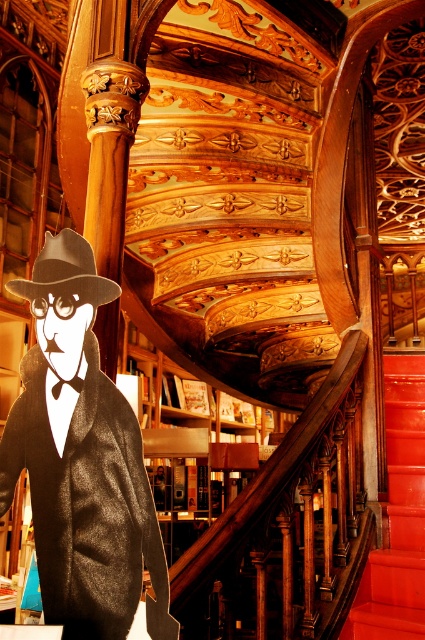
You are a tailor measuring two items for a client. The client has a matte black coat at center and a matte brown fedora at center. The tailor needs to know if the distance between them is sufficient to place a 12 inch ruler between them without moving the items. Can the tailor do this?

The matte black coat at center and matte brown fedora at center are 10.65 inches apart, which is less than 12 inches. Therefore, the tailor cannot place a 12 inch ruler between them without moving the items.

Looking at this image, you are an interior designer planning to hang a decorative item on the wall behind the matte black coat at center and the matte brown fedora at center. Since both items are at the center, which one should you consider positioning your new decoration relative to?

The matte black coat at center is in front of the matte brown fedora at center, so you should position the new decoration behind the matte brown fedora at center to ensure it is visible behind both items.

You are standing at the base of the grand staircase and notice two items at the center of the scene. One is the shiny red stair at center and the other is the matte brown fedora at center. Which item is positioned to the right when viewed from your perspective?

The shiny red stair at center is to the right of the matte brown fedora at center.